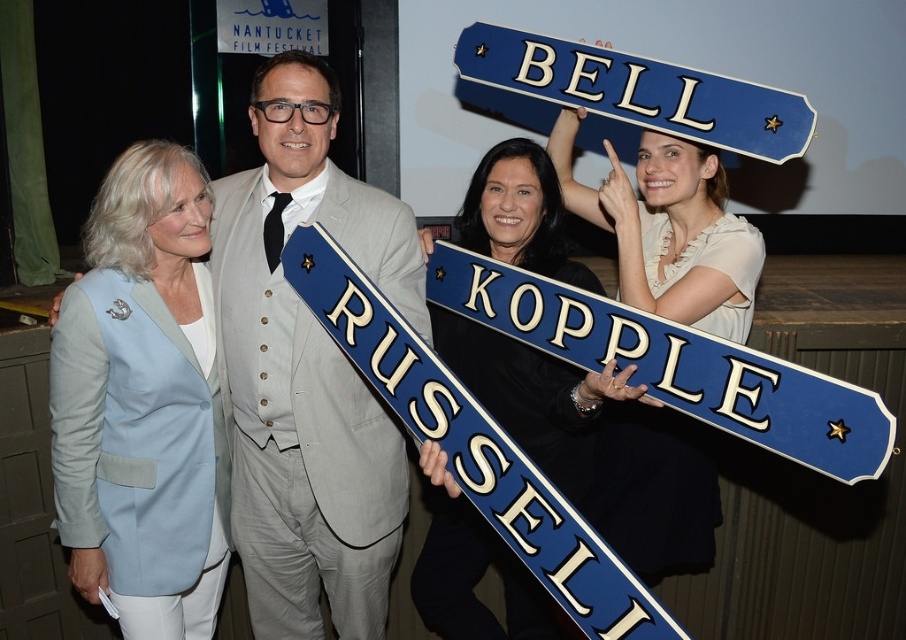
Question: Which point appears closest to the camera in this image?

Choices:
 (A) (709, 240)
 (B) (641, 99)

Answer: (A)

Question: Which point is farther to the camera?

Choices:
 (A) (454, 572)
 (B) (673, 452)
 (C) (741, 388)

Answer: (A)

Question: Which point is farther to the camera?

Choices:
 (A) light blue fabric jacket at left
 (B) blue satin sash at center

Answer: (A)

Question: Does gray suit at center have a lesser width compared to blue painted wood street sign at center?

Choices:
 (A) yes
 (B) no

Answer: (A)

Question: Does white satin dress at upper center have a lesser width compared to blue satin sash at center?

Choices:
 (A) no
 (B) yes

Answer: (A)

Question: Can you confirm if blue metallic street sign at center is positioned to the left of blue painted wood street sign at center?

Choices:
 (A) no
 (B) yes

Answer: (B)